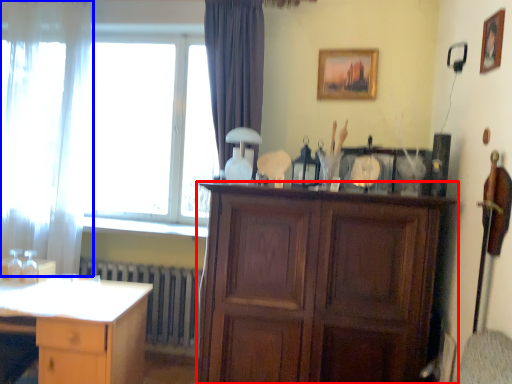
Question: Among these objects, which one is farthest to the camera, cabinetry (highlighted by a red box) or curtain (highlighted by a blue box)?

Choices:
 (A) cabinetry
 (B) curtain

Answer: (B)